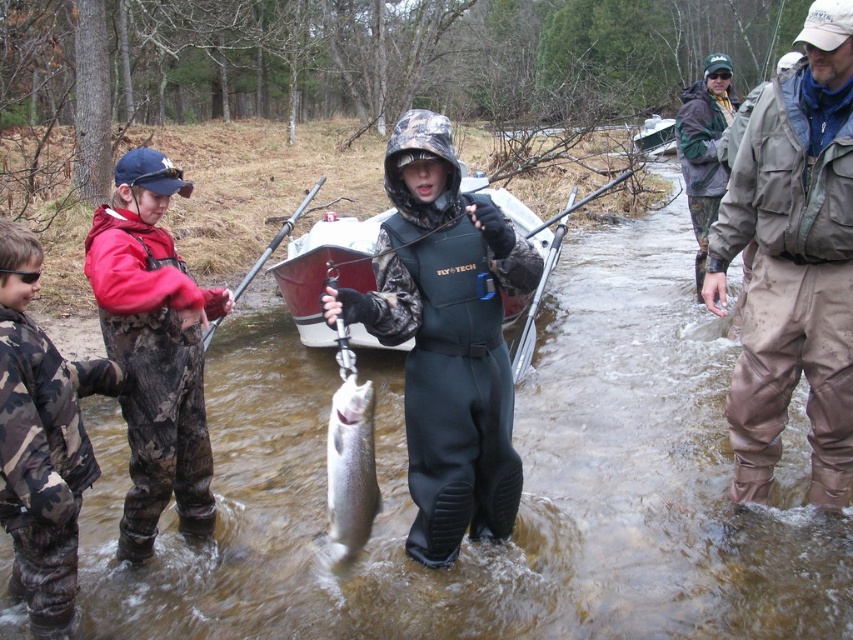
Is point (837, 372) positioned in front of point (720, 99)?

Yes, point (837, 372) is in front of point (720, 99).

Does point (821, 330) lie behind point (693, 184)?

No.

Identify the location of khaki waterproof pants at right. (793, 264).

Which is more to the left, red camo waders at left or camo pants at left?

camo pants at left

Consider the image. Which is more to the right, red camo waders at left or camo pants at left?

Positioned to the right is red camo waders at left.

Between point (192, 456) and point (25, 509), which one is positioned in front?

Point (25, 509)

The width and height of the screenshot is (853, 640). Find the location of `red camo waders at left`. red camo waders at left is located at coordinates (154, 349).

Is black neoprene wetsuit at center above red camo waders at left?

Incorrect, black neoprene wetsuit at center is not positioned above red camo waders at left.

Does black neoprene wetsuit at center lie behind red camo waders at left?

No, it is in front of red camo waders at left.

Locate an element on the screen. black neoprene wetsuit at center is located at coordinates (445, 337).

Where is `black neoprene wetsuit at center`? Image resolution: width=853 pixels, height=640 pixels. black neoprene wetsuit at center is located at coordinates (445, 337).